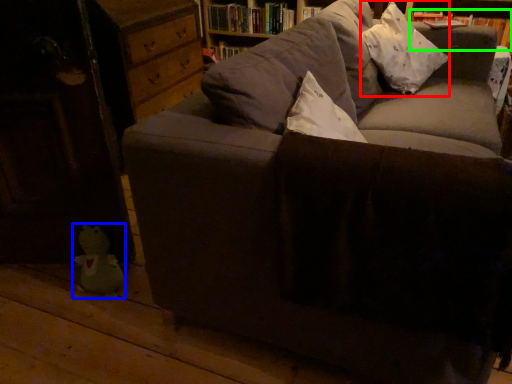
Question: Considering the real-world distances, which object is closest to throw pillow (highlighted by a red box)? toy (highlighted by a blue box) or book (highlighted by a green box).

Choices:
 (A) toy
 (B) book

Answer: (B)